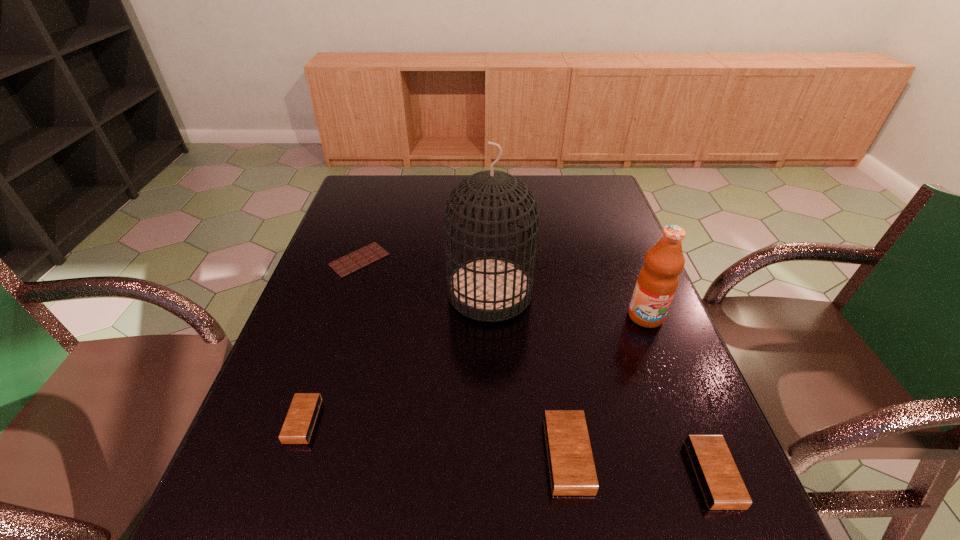
Locate an element on the screen. Image resolution: width=960 pixels, height=540 pixels. vacant space at the far edge is located at coordinates (421, 194).

You are a GUI agent. You are given a task and a screenshot of the screen. Output one action in this format:
    pyautogui.click(x=<x>, y=<y>)
    Task: Click on the free space at the near edge of the desktop
    The image size is (960, 540).
    Given the screenshot: What is the action you would take?
    pyautogui.click(x=374, y=478)

This screenshot has height=540, width=960. Identify the location of vacant space at the left edge of the desktop. (332, 323).

In the image, there is a desktop. Where is `vacant space at the right edge`? This screenshot has height=540, width=960. vacant space at the right edge is located at coordinates (621, 298).

Locate an element on the screen. The width and height of the screenshot is (960, 540). free space at the far left corner is located at coordinates (354, 191).

The width and height of the screenshot is (960, 540). Find the location of `free region at the far right corner`. free region at the far right corner is located at coordinates (601, 188).

This screenshot has height=540, width=960. What are the coordinates of `vacant region between the fruit juice and the rightmost alarm clock` in the screenshot? It's located at (680, 395).

This screenshot has height=540, width=960. In order to click on vacant point located between the second alarm clock from left to right and the leftmost alarm clock in this screenshot , I will do `click(435, 438)`.

Find the location of `vacant area that lies between the birdcage and the rightmost alarm clock`. vacant area that lies between the birdcage and the rightmost alarm clock is located at coordinates (601, 383).

Find the location of a particular element. unoccupied position between the second tallest alarm clock and the fruit juice is located at coordinates (680, 395).